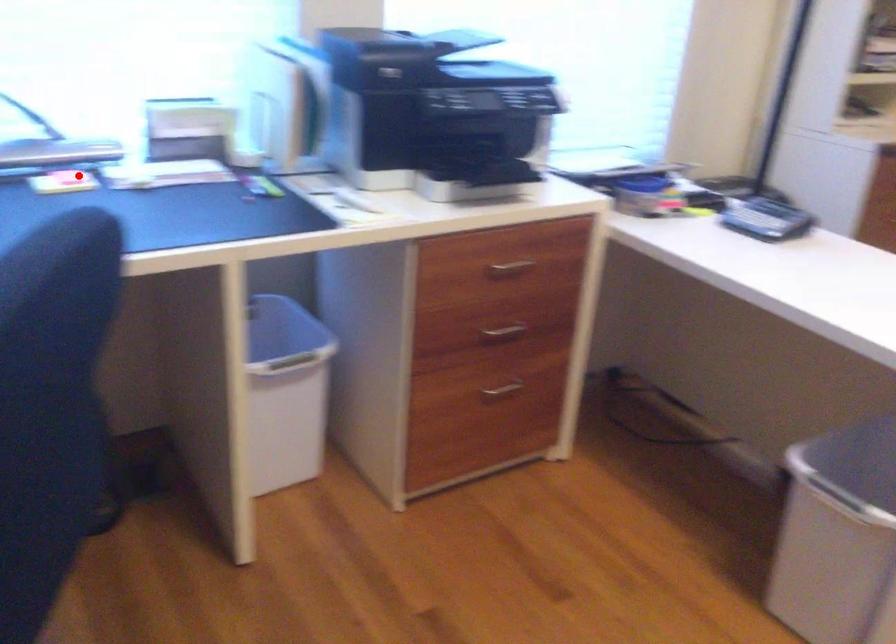
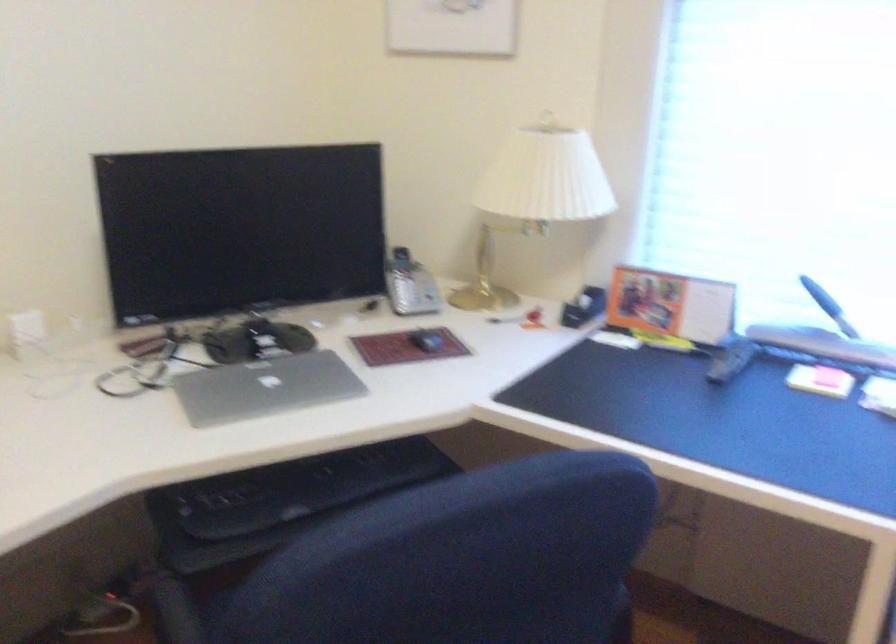
Find the pixel in the second image that matches the highlighted location in the first image.

(829, 377)